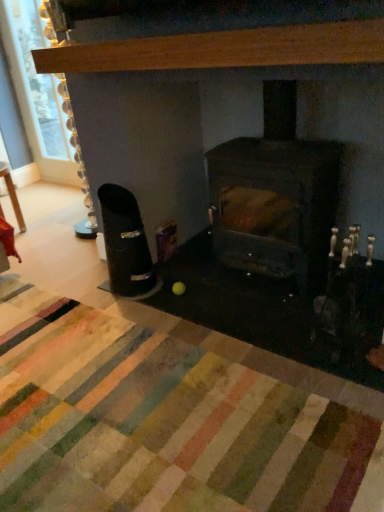
The height and width of the screenshot is (512, 384). What are the coordinates of `unoccupied area in front of dark brown wood burning stove at center` in the screenshot? It's located at (252, 333).